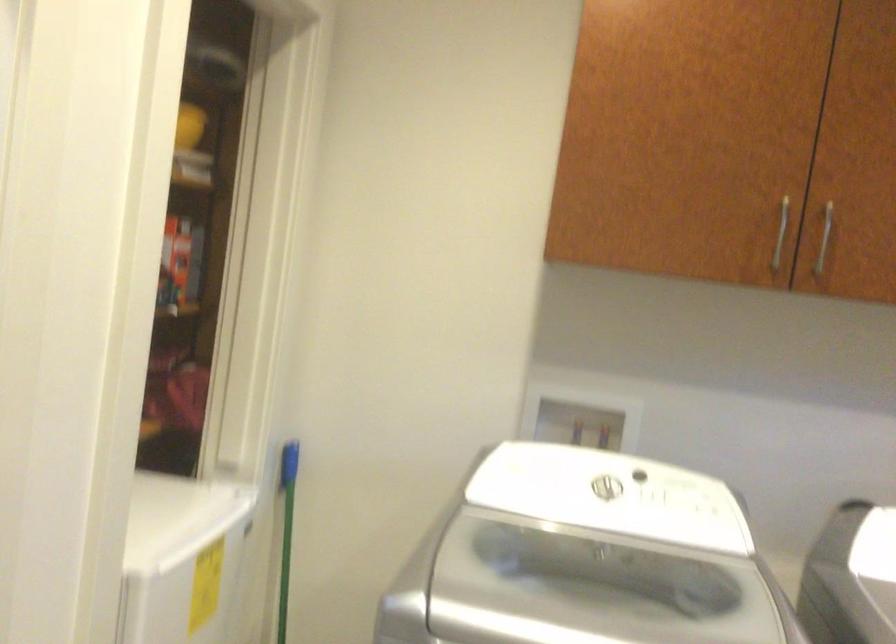
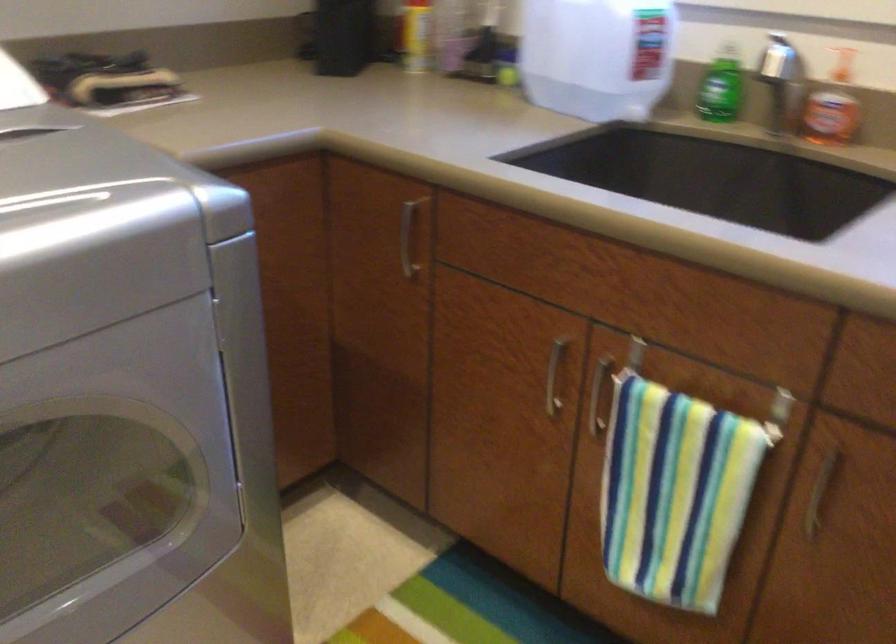
The first image is from the beginning of the video and the second image is from the end. How did the camera likely rotate when shooting the video?

The camera rotated toward right-down.